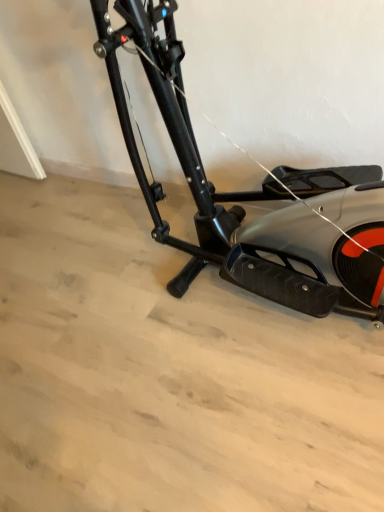
What do you see at coordinates (253, 195) in the screenshot?
I see `metallic silver elliptical trainer at center` at bounding box center [253, 195].

I want to click on metallic silver elliptical trainer at center, so click(253, 195).

Find the location of a particular element. metallic silver elliptical trainer at center is located at coordinates (253, 195).